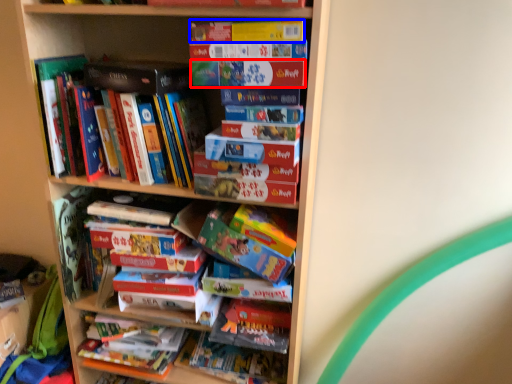
Question: Among these objects, which one is farthest to the camera, paperback book (highlighted by a red box) or paperback book (highlighted by a blue box)?

Choices:
 (A) paperback book
 (B) paperback book

Answer: (A)